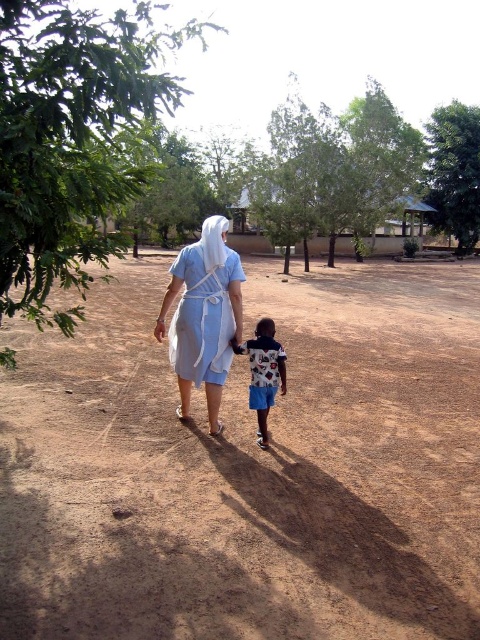
You are a photographer trying to capture a photo of the printed cotton shirt at center and the green leafy tree at upper right. Which object should you focus on first to ensure both are in focus?

The green leafy tree at upper right is closer to you than the printed cotton shirt at center, so you should focus on the green leafy tree at upper right first to ensure both are in focus.

You are standing at the camera position and want to walk towards the green leafy tree at left. What direction should you face to head directly towards it?

Since the green leafy tree at left is located at point (x=72, y=138) in the image, you should face towards the left side of the frame to head directly towards it.

You are standing at the point with coordinates point (x=436, y=172) and want to walk towards the point with coordinates point (x=217, y=308). Are you facing the same direction as the two people in the image?

Yes, because point (x=217, y=308) is in front of point (x=436, y=172), so walking towards it means facing the same direction as the two people who are walking away from the camera towards the trees and buildings in the background.